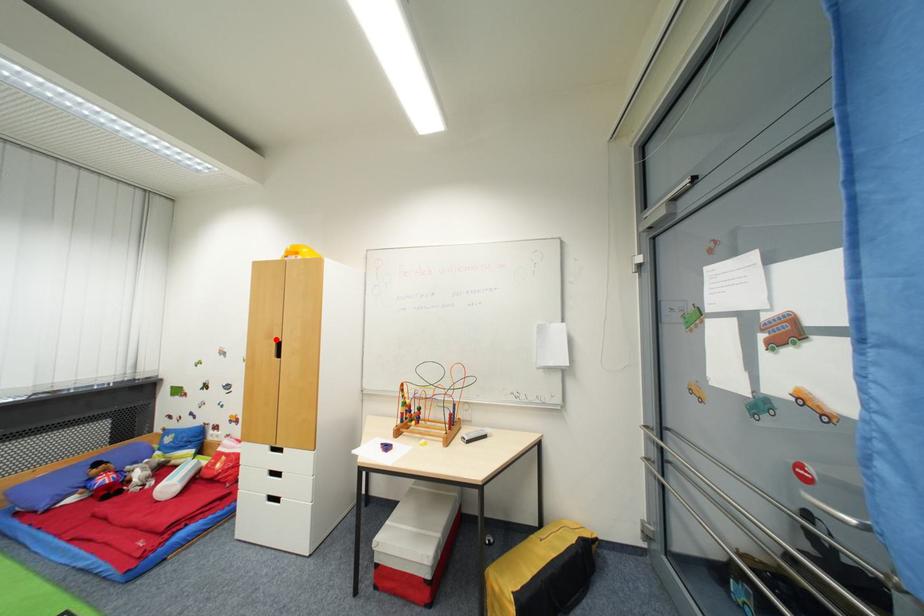
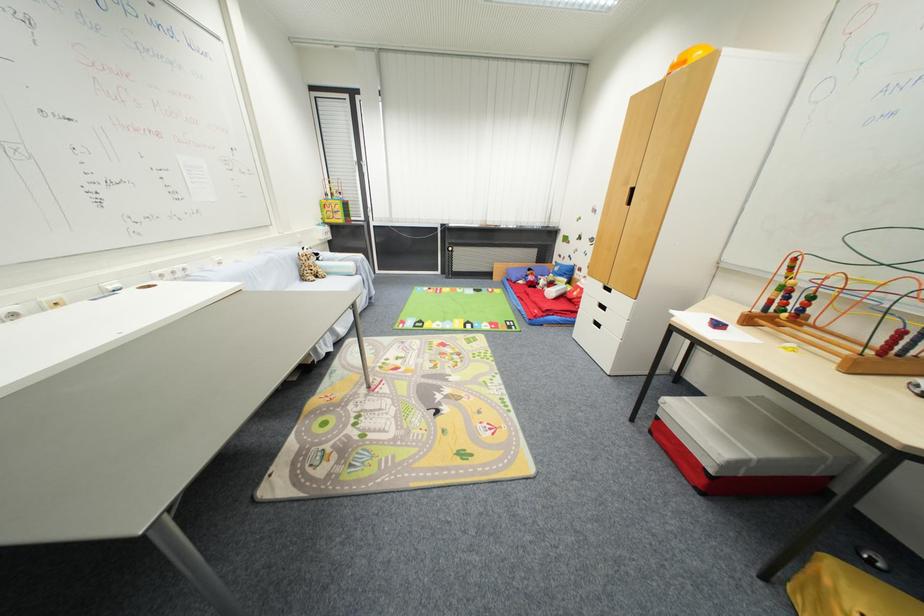
Question: I am providing you with two images of the same scene from different viewpoints. Image1 has a red point marked. In image2, the corresponding 3D location appears at what relative position? Reply with the corresponding letter.

Choices:
 (A) Closer
 (B) Farther

Answer: (A)